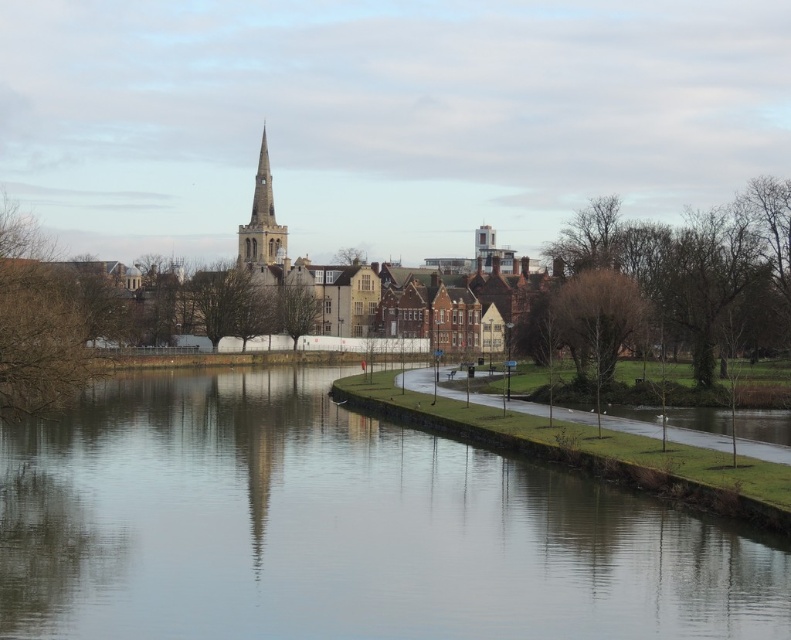
Does brown leafless tree at left have a greater width compared to bare brown tree at right?

Yes, brown leafless tree at left is wider than bare brown tree at right.

Is point (27, 388) less distant than point (623, 340)?

That is True.

Which is behind, point (2, 308) or point (600, 385)?

The point (600, 385) is more distant.

You are a GUI agent. You are given a task and a screenshot of the screen. Output one action in this format:
    pyautogui.click(x=<x>, y=<y>)
    Task: Click on the brown leafless tree at left
    This screenshot has width=791, height=640.
    Given the screenshot: What is the action you would take?
    pyautogui.click(x=47, y=321)

Does point (553, 627) come farther from viewer compared to point (464, 298)?

No, (553, 627) is in front of (464, 298).

Is smooth water at center above smooth stone church at center?

No, smooth water at center is not above smooth stone church at center.

Which is in front, point (214, 566) or point (485, 275)?

Point (214, 566) is more forward.

Image resolution: width=791 pixels, height=640 pixels. What are the coordinates of `smooth water at center` in the screenshot? It's located at (339, 529).

Which is below, bare wood trees at right or brown leafless tree at left?

brown leafless tree at left is lower down.

What do you see at coordinates (698, 268) in the screenshot?
I see `bare wood trees at right` at bounding box center [698, 268].

This screenshot has width=791, height=640. In order to click on bare wood trees at right in this screenshot , I will do `click(698, 268)`.